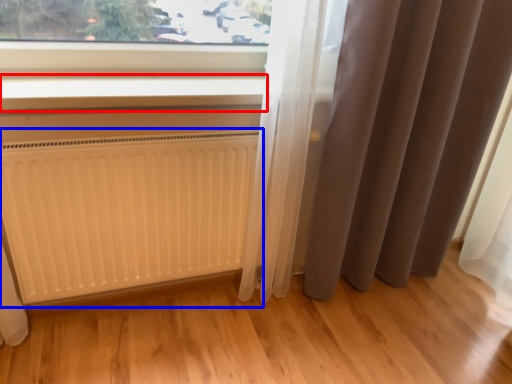
Question: Which point is further to the camera, window sill (highlighted by a red box) or radiator (highlighted by a blue box)?

Choices:
 (A) window sill
 (B) radiator

Answer: (B)